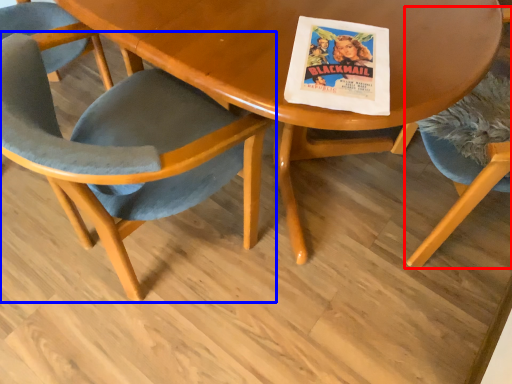
Question: Which object appears farthest to the camera in this image, chair (highlighted by a red box) or chair (highlighted by a blue box)?

Choices:
 (A) chair
 (B) chair

Answer: (A)